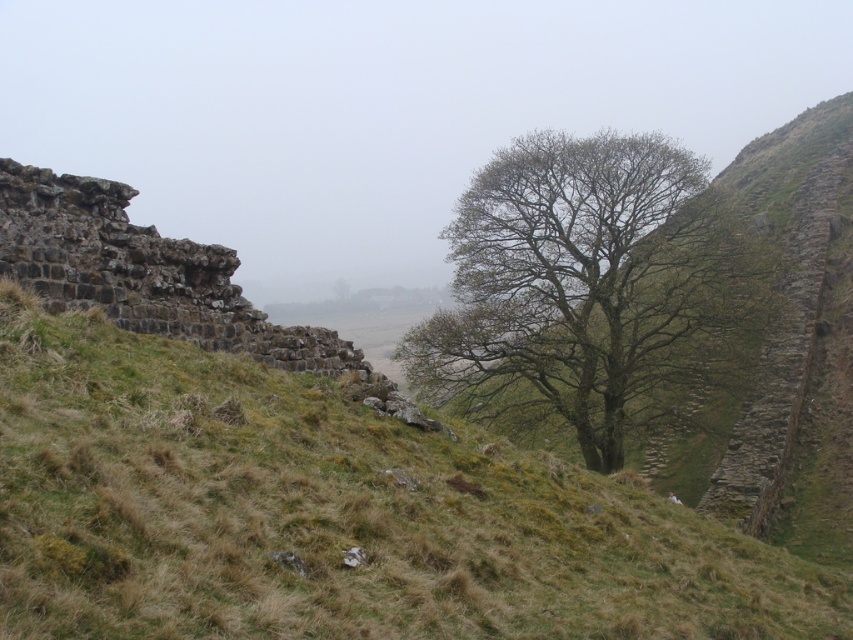
Question: Is green grassy at center below green leafy tree at center?

Choices:
 (A) yes
 (B) no

Answer: (A)

Question: Which point is closer to the camera taking this photo?

Choices:
 (A) (253, 337)
 (B) (671, 288)

Answer: (A)

Question: Is green grassy at center behind green leafy tree at center?

Choices:
 (A) yes
 (B) no

Answer: (B)

Question: Based on their relative distances, which object is farther from the green leafy tree at center?

Choices:
 (A) green grassy at center
 (B) rustic stone cliff at left

Answer: (A)

Question: Which object is the closest to the green grassy at center?

Choices:
 (A) green leafy tree at center
 (B) rustic stone cliff at left

Answer: (B)

Question: From the image, what is the correct spatial relationship of green grassy at center in relation to rustic stone cliff at left?

Choices:
 (A) left
 (B) right

Answer: (B)